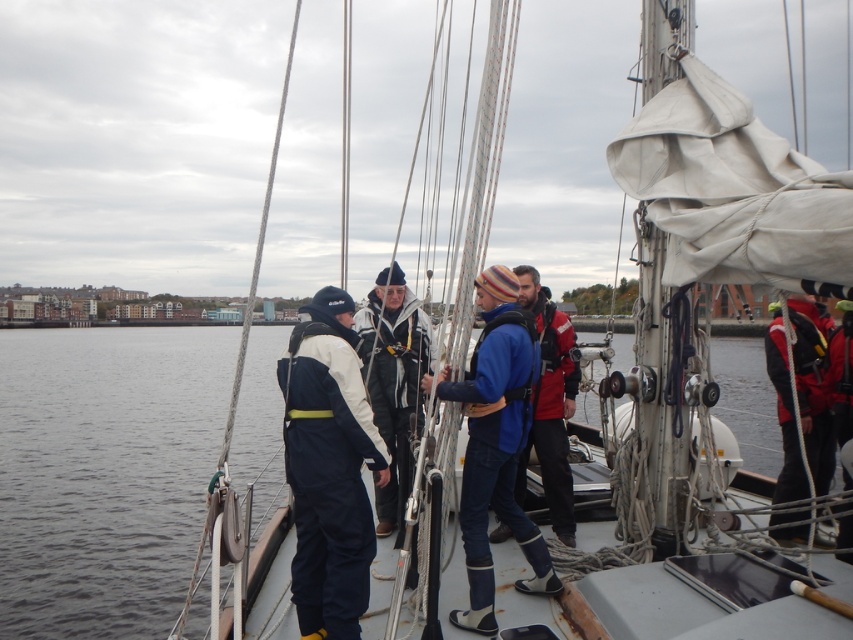
You are a photographer standing on the deck of the boat and want to take a photo of the navy blue waterproof jumpsuit at center and the red life jacket at right. If you want to ensure both objects are fully visible in the frame without moving the camera, which object should you focus on to avoid cropping?

You should focus on the red life jacket at right because its width is larger than the navy blue waterproof jumpsuit at center, so it requires more space in the frame to avoid cropping.

You are a photographer on the boat and want to take a photo of the blue fabric jacket at center without the transparent water at center appearing in the shot. Which direction should you move the camera to avoid the water?

The transparent water at center is positioned on the left side of the blue fabric jacket at center. To avoid the water, move the camera to the right side of the blue fabric jacket at center.